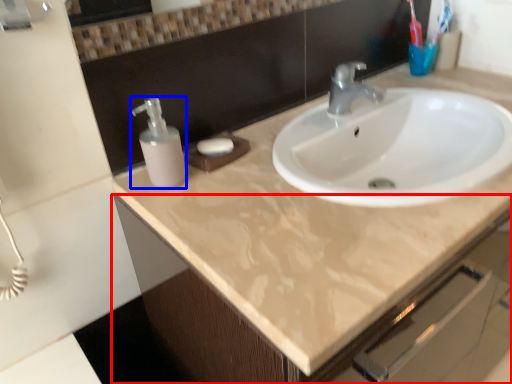
Question: Which point is closer to the camera, bathroom cabinet (highlighted by a red box) or soap dispenser (highlighted by a blue box)?

Choices:
 (A) bathroom cabinet
 (B) soap dispenser

Answer: (A)